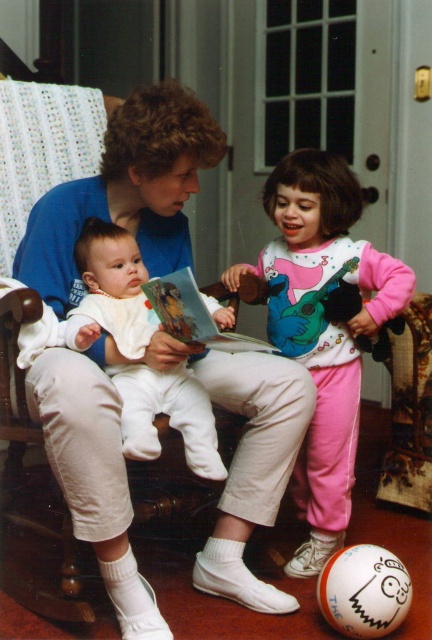
Is point (190, 104) more distant than point (123, 396)?

Yes.

Who is positioned more to the right, matte blue shirt at center or white soft baby at center?

white soft baby at center is more to the right.

What do you see at coordinates (127, 192) in the screenshot? I see `matte blue shirt at center` at bounding box center [127, 192].

This screenshot has height=640, width=432. In order to click on matte blue shirt at center in this screenshot , I will do `click(127, 192)`.

How distant is matte blue shirt at center from pink fleece onesie at center?

The distance of matte blue shirt at center from pink fleece onesie at center is 12.32 inches.

Who is positioned more to the left, matte blue shirt at center or pink fleece onesie at center?

matte blue shirt at center is more to the left.

Where is `matte blue shirt at center`? This screenshot has height=640, width=432. matte blue shirt at center is located at coordinates [127, 192].

Does pink fleece onesie at center have a larger size compared to white soft baby at center?

Correct, pink fleece onesie at center is larger in size than white soft baby at center.

Which is above, pink fleece onesie at center or white soft baby at center?

white soft baby at center is higher up.

Is point (359, 380) closer to camera compared to point (132, 336)?

No, it is not.

Image resolution: width=432 pixels, height=640 pixels. I want to click on pink fleece onesie at center, so click(x=323, y=326).